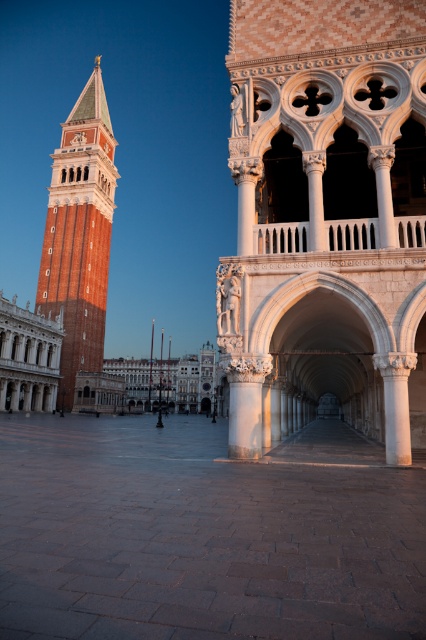
Which is above, red brick bell tower at left or white marble palace at left?

red brick bell tower at left is higher up.

Locate an element on the screen. red brick bell tower at left is located at coordinates (80, 234).

At what (x,y) coordinates should I click in order to perform the action: click on red brick bell tower at left. Please return your answer as a coordinate pair (x, y). Looking at the image, I should click on point(80,234).

The image size is (426, 640). Identify the location of red brick bell tower at left. (80, 234).

Who is more distant from viewer, (330, 282) or (57, 333)?

The point (57, 333) is behind.

Between point (310, 384) and point (13, 323), which one is positioned in front?

Positioned in front is point (310, 384).

Which is behind, point (423, 349) or point (51, 323)?

The point (51, 323) is behind.

The height and width of the screenshot is (640, 426). What are the coordinates of `white stone archway at center` in the screenshot? It's located at (325, 220).

Does white marble palace at left appear on the right side of white marble palace at center?

Correct, you'll find white marble palace at left to the right of white marble palace at center.

Can you confirm if white marble palace at left is positioned to the left of white marble palace at center?

Incorrect, white marble palace at left is not on the left side of white marble palace at center.

Between point (5, 381) and point (207, 378), which one is positioned in front?

Point (5, 381) is in front.

What are the coordinates of `white marble palace at left` in the screenshot? It's located at (28, 358).